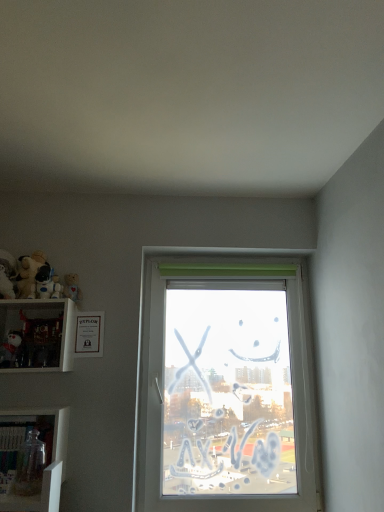
Locate an element on the screen. The width and height of the screenshot is (384, 512). blank space above clear glass jar at lower left, acting as the 1th shelf starting from the bottom (from a real-world perspective) is located at coordinates (27, 416).